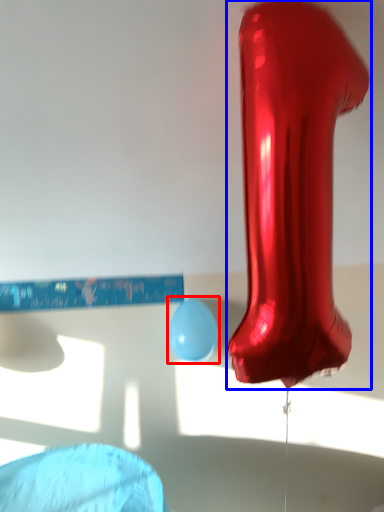
Question: Which object is further to the camera taking this photo, balloon (highlighted by a red box) or footwear (highlighted by a blue box)?

Choices:
 (A) balloon
 (B) footwear

Answer: (A)